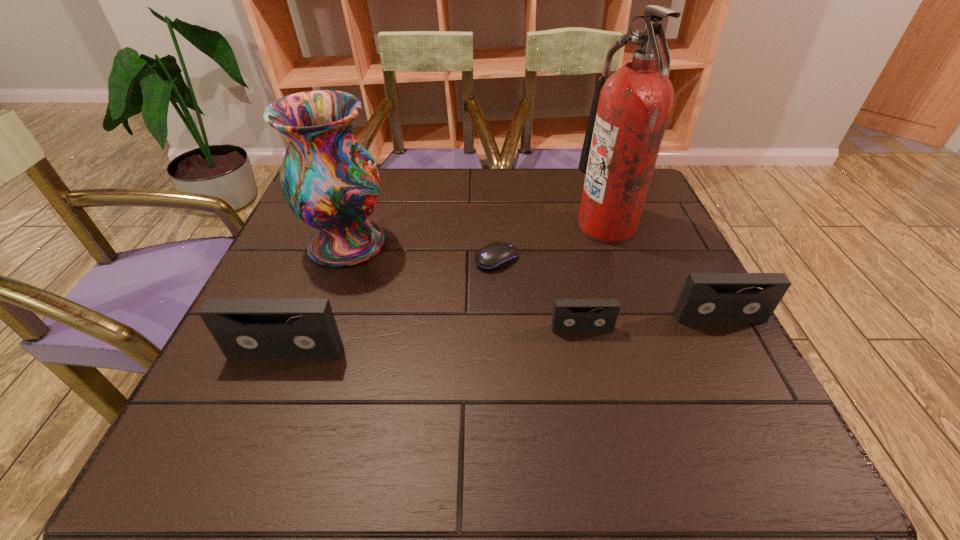
Choose which videotape is the second nearest neighbor to the fourth object from right to left. Please provide its 2D coordinates. Your answer should be formatted as a tuple, i.e. [(x, y)], where the tuple contains the x and y coordinates of a point satisfying the conditions above.

[(244, 328)]

The width and height of the screenshot is (960, 540). What are the coordinates of `videotape object that ranks as the second closest to the fire extinguisher` in the screenshot? It's located at (569, 315).

Locate an element on the screen. vacant area that satisfies the following two spatial constraints: 1. on the front of the fire extinguisher near the operation label; 2. on the front-facing side of the second farthest videotape is located at coordinates (641, 328).

This screenshot has height=540, width=960. I want to click on free location that satisfies the following two spatial constraints: 1. on the front of the fire extinguisher near the operation label; 2. on the front-facing side of the nearest videotape, so (x=650, y=352).